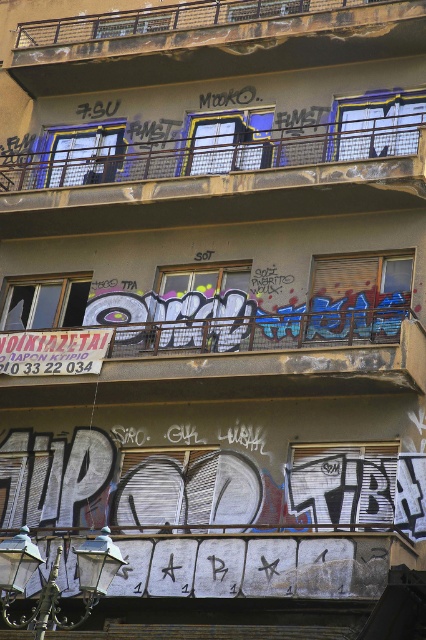
You are an artist planning to paint a mural on the building. You see the metallic graffiti at center and the metallic mesh balcony at upper center. Which object is located to the right of the other?

The metallic graffiti at center is positioned on the right side of metallic mesh balcony at upper center, so the metallic graffiti at center is to the right of the metallic mesh balcony at upper center.

You are standing in front of the building and want to locate the metallic graffiti at center. Based on the coordinates provided, where should you look relative to the building?

The metallic graffiti at center is located at coordinates point (236,365), which means it is positioned slightly to the right and just below the center of the building.

You are an artist planning to paint a mural on the building. You have two spaces in mind between the metallic graffiti at center and the brushed metal balcony at upper center. Which space is wider?

The brushed metal balcony at upper center is wider than the metallic graffiti at center.